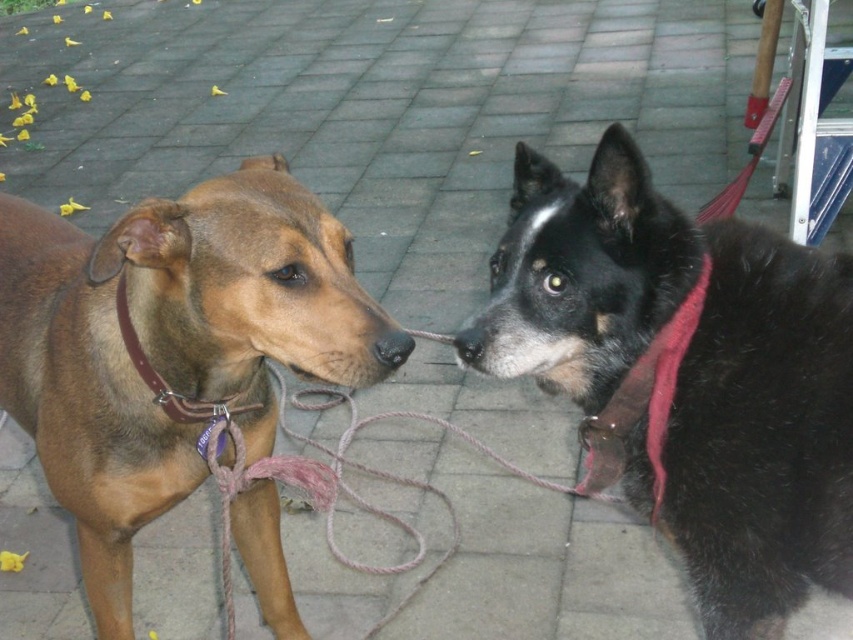
Question: In this image, where is black fur dog at center located relative to brown matte dog at left?

Choices:
 (A) above
 (B) below

Answer: (B)

Question: Among these objects, which one is nearest to the camera?

Choices:
 (A) brown matte dog at left
 (B) red fabric neckband at right
 (C) black fur dog at center

Answer: (C)

Question: Can you confirm if black fur dog at center is wider than brown matte dog at left?

Choices:
 (A) no
 (B) yes

Answer: (A)

Question: Among these points, which one is nearest to the camera?

Choices:
 (A) (729, 461)
 (B) (601, 467)
 (C) (125, 579)

Answer: (A)

Question: Which point is farther to the camera?

Choices:
 (A) black fur dog at center
 (B) red fabric neckband at right
 (C) brown matte dog at left

Answer: (B)

Question: Is black fur dog at center behind brown matte dog at left?

Choices:
 (A) yes
 (B) no

Answer: (B)